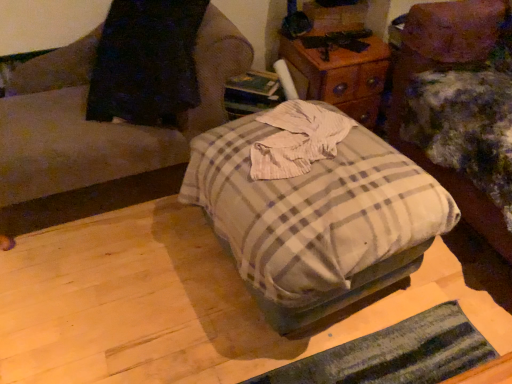
Question: Does plaid fabric ottoman at center have a greater height compared to wooden nightstand at upper center?

Choices:
 (A) no
 (B) yes

Answer: (B)

Question: Considering the relative sizes of plaid fabric ottoman at center and wooden nightstand at upper center in the image provided, is plaid fabric ottoman at center smaller than wooden nightstand at upper center?

Choices:
 (A) no
 (B) yes

Answer: (A)

Question: Are plaid fabric ottoman at center and wooden nightstand at upper center far apart?

Choices:
 (A) yes
 (B) no

Answer: (B)

Question: Can wooden nightstand at upper center be found inside plaid fabric ottoman at center?

Choices:
 (A) no
 (B) yes

Answer: (A)

Question: From the image's perspective, is plaid fabric ottoman at center on top of wooden nightstand at upper center?

Choices:
 (A) yes
 (B) no

Answer: (B)

Question: Does point (306, 49) appear closer or farther from the camera than point (216, 150)?

Choices:
 (A) closer
 (B) farther

Answer: (B)

Question: From their relative heights in the image, would you say wooden nightstand at upper center is taller or shorter than plaid fabric ottoman at center?

Choices:
 (A) short
 (B) tall

Answer: (A)

Question: Is wooden nightstand at upper center to the left or to the right of plaid fabric ottoman at center in the image?

Choices:
 (A) right
 (B) left

Answer: (A)

Question: Considering the positions of wooden nightstand at upper center and plaid fabric ottoman at center in the image, is wooden nightstand at upper center wider or thinner than plaid fabric ottoman at center?

Choices:
 (A) thin
 (B) wide

Answer: (A)

Question: From the image's perspective, is plaid fabric ottoman at center, the first furniture viewed from the right, located above or below plaid fabric ottoman at center, the second furniture when ordered from right to left?

Choices:
 (A) below
 (B) above

Answer: (A)

Question: Is plaid fabric ottoman at center, arranged as the second furniture when viewed from the left, situated inside plaid fabric ottoman at center, the second furniture when ordered from right to left, or outside?

Choices:
 (A) outside
 (B) inside

Answer: (A)

Question: Is plaid fabric ottoman at center, arranged as the second furniture when viewed from the left, in front of or behind plaid fabric ottoman at center, the second furniture when ordered from right to left, in the image?

Choices:
 (A) behind
 (B) front

Answer: (B)

Question: Is point (418, 36) closer or farther from the camera than point (122, 152)?

Choices:
 (A) closer
 (B) farther

Answer: (B)

Question: Does point (312, 72) appear closer or farther from the camera than point (67, 69)?

Choices:
 (A) farther
 (B) closer

Answer: (A)

Question: Looking at their shapes, would you say wooden nightstand at upper center is wider or thinner than plaid fabric ottoman at center, the second furniture when ordered from right to left?

Choices:
 (A) wide
 (B) thin

Answer: (B)